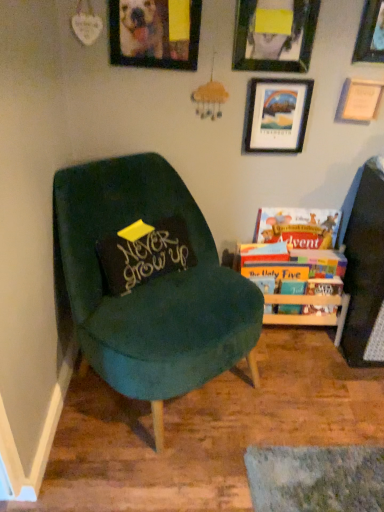
Question: Does hardcover books at right, placed as the 2th book when sorted from top to bottom, have a smaller size compared to velvet green chair at left?

Choices:
 (A) yes
 (B) no

Answer: (A)

Question: From a real-world perspective, is hardcover books at right, which is the first book from bottom to top, physically above velvet green chair at left?

Choices:
 (A) yes
 (B) no

Answer: (B)

Question: Considering the relative sizes of hardcover books at right, which is the first book from bottom to top, and velvet green chair at left in the image provided, is hardcover books at right, which is the first book from bottom to top, wider than velvet green chair at left?

Choices:
 (A) no
 (B) yes

Answer: (A)

Question: Is the depth of hardcover books at right, placed as the 2th book when sorted from top to bottom, less than that of velvet green chair at left?

Choices:
 (A) yes
 (B) no

Answer: (B)

Question: Could you tell me if hardcover books at right, which is the first book from bottom to top, is facing velvet green chair at left?

Choices:
 (A) no
 (B) yes

Answer: (A)

Question: Is matte black picture frame at upper center, placed as the second picture frame when sorted from left to right, inside the boundaries of wooden picture frame at upper right, the 4th picture frame viewed from the left, or outside?

Choices:
 (A) inside
 (B) outside

Answer: (B)

Question: From the image's perspective, is matte black picture frame at upper center, placed as the second picture frame when sorted from left to right, located above or below wooden picture frame at upper right, the second picture frame positioned from the right?

Choices:
 (A) above
 (B) below

Answer: (A)

Question: Based on their positions, is matte black picture frame at upper center, arranged as the 4th picture frame when viewed from the right, located to the left or right of wooden picture frame at upper right, the 4th picture frame viewed from the left?

Choices:
 (A) left
 (B) right

Answer: (A)

Question: Looking at the image, does matte black picture frame at upper center, arranged as the 4th picture frame when viewed from the right, seem bigger or smaller compared to wooden picture frame at upper right, the 4th picture frame viewed from the left?

Choices:
 (A) small
 (B) big

Answer: (B)

Question: Would you say hardcover books at right, placed as the 2th book when sorted from top to bottom, is to the left or to the right of wooden picture frame at upper right, marked as the 5th picture frame in a left-to-right arrangement, in the picture?

Choices:
 (A) left
 (B) right

Answer: (A)

Question: In terms of size, does hardcover books at right, which is the first book from bottom to top, appear bigger or smaller than wooden picture frame at upper right, placed as the 1th picture frame when sorted from right to left?

Choices:
 (A) big
 (B) small

Answer: (A)

Question: In the image, is hardcover books at right, which is the first book from bottom to top, positioned in front of or behind wooden picture frame at upper right, placed as the 1th picture frame when sorted from right to left?

Choices:
 (A) front
 (B) behind

Answer: (B)

Question: From the image's perspective, is hardcover books at right, which is the first book from bottom to top, located above or below wooden picture frame at upper right, placed as the 1th picture frame when sorted from right to left?

Choices:
 (A) below
 (B) above

Answer: (A)

Question: Considering the positions of point (183, 37) and point (261, 224), is point (183, 37) closer or farther from the camera than point (261, 224)?

Choices:
 (A) farther
 (B) closer

Answer: (B)

Question: Is wooden picture frame at upper center, which is the first picture frame in left-to-right order, to the left or to the right of hardcover books at right, placed as the 2th book when sorted from top to bottom, in the image?

Choices:
 (A) left
 (B) right

Answer: (A)